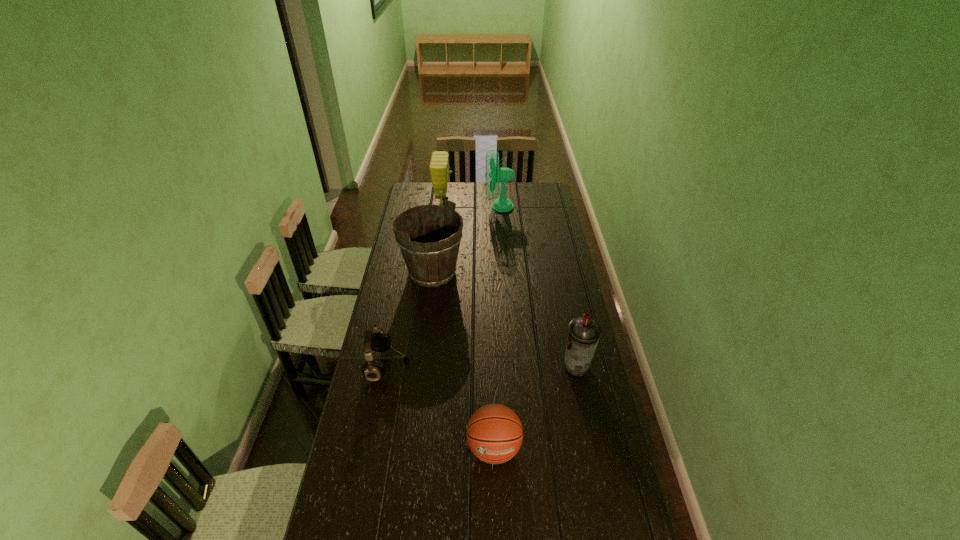
Where is `fan`? fan is located at coordinates (504, 175).

Image resolution: width=960 pixels, height=540 pixels. I want to click on bucket, so click(x=430, y=263).

Identify the location of sponge. (439, 166).

You are a GUI agent. You are given a task and a screenshot of the screen. Output one action in this format:
    pyautogui.click(x=<x>, y=<y>)
    Task: Click on the rightmost object
    Image resolution: width=960 pixels, height=540 pixels.
    Given the screenshot: What is the action you would take?
    tap(583, 334)

Where is `headset`? headset is located at coordinates (378, 341).

Locate an element on the screen. the nearest object is located at coordinates 494,433.

Locate an element on the screen. vacant space located in front of the fan to blow air is located at coordinates (475, 207).

Locate an element on the screen. This screenshot has height=540, width=960. vacant region located in front of the fan to blow air is located at coordinates (465, 207).

Locate an element on the screen. vacant area situated in front of the fan to blow air is located at coordinates (475, 207).

Locate an element on the screen. This screenshot has height=540, width=960. vacant space located 0.090m on the front of the bucket is located at coordinates (428, 308).